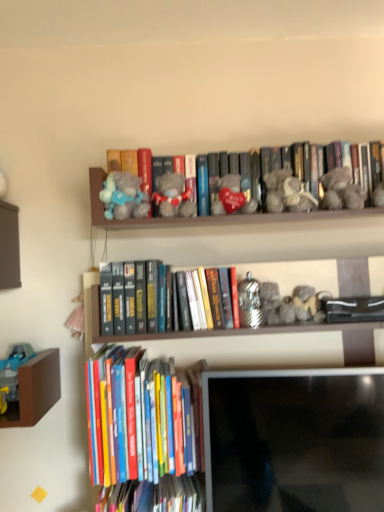
The height and width of the screenshot is (512, 384). Find the location of `hardcover book at lower center, acting as the 3th book starting from the top`. hardcover book at lower center, acting as the 3th book starting from the top is located at coordinates (153, 496).

What do you see at coordinates (142, 417) in the screenshot? The height and width of the screenshot is (512, 384). I see `hardcover books at lower left, the second book viewed from the top` at bounding box center [142, 417].

Based on the photo, in order to face fuzzy gray teddy bear at upper right, which is the first toy in right-to-left order, should I rotate leftwards or rightwards?

Rotate your view right by about 19.348°.

This screenshot has width=384, height=512. What are the coordinates of `fluffy gray teddy bear at upper center, the fourth toy viewed from the right` in the screenshot? It's located at (123, 196).

In order to click on velvet heart at center, marked as the 3th toy in a left-to-right arrangement in this screenshot , I will do `click(232, 197)`.

Locate an element on the screen. fluffy plush bear at center, arranged as the third toy when viewed from the right is located at coordinates (173, 196).

Is matte black monitor at lower center positioned far away from fuzzy gray teddy bear at upper right, which is the first toy in right-to-left order?

That's not correct — matte black monitor at lower center is a little close to fuzzy gray teddy bear at upper right, which is the first toy in right-to-left order.

Is matte black monitor at lower center to the left or to the right of fuzzy gray teddy bear at upper right, which is the first toy in right-to-left order, in the image?

In the image, matte black monitor at lower center appears on the left side of fuzzy gray teddy bear at upper right, which is the first toy in right-to-left order.

Considering the sizes of matte black monitor at lower center and fuzzy gray teddy bear at upper right, the fourth toy when ordered from left to right, in the image, is matte black monitor at lower center bigger or smaller than fuzzy gray teddy bear at upper right, the fourth toy when ordered from left to right,?

matte black monitor at lower center is bigger than fuzzy gray teddy bear at upper right, the fourth toy when ordered from left to right.

From a real-world perspective, is matte black monitor at lower center positioned above or below fuzzy gray teddy bear at upper right, which is the first toy in right-to-left order?

Clearly, from a real-world perspective, matte black monitor at lower center is below fuzzy gray teddy bear at upper right, which is the first toy in right-to-left order.

Is gray plush bear at center, the third book ordered from the bottom, inside or outside of fuzzy gray teddy bear at upper right, the fourth toy when ordered from left to right?

gray plush bear at center, the third book ordered from the bottom, cannot be found inside fuzzy gray teddy bear at upper right, the fourth toy when ordered from left to right.

Where is `book behind the fuzzy gray teddy bear at upper right, which is the first toy in right-to-left order`? The height and width of the screenshot is (512, 384). book behind the fuzzy gray teddy bear at upper right, which is the first toy in right-to-left order is located at coordinates (321, 206).

Looking at this image, considering the relative sizes of gray plush bear at center, which is the 1th book in top-to-bottom order, and fuzzy gray teddy bear at upper right, which is the first toy in right-to-left order, in the image provided, is gray plush bear at center, which is the 1th book in top-to-bottom order, shorter than fuzzy gray teddy bear at upper right, which is the first toy in right-to-left order,?

In fact, gray plush bear at center, which is the 1th book in top-to-bottom order, may be taller than fuzzy gray teddy bear at upper right, which is the first toy in right-to-left order.

Can you confirm if gray plush bear at center, the third book ordered from the bottom, is smaller than fuzzy gray teddy bear at upper right, which is the first toy in right-to-left order?

No.

From the image's perspective, is fuzzy gray teddy bear at upper right, the fourth toy when ordered from left to right, located above fluffy plush bear at center, arranged as the third toy when viewed from the right?

Correct, fuzzy gray teddy bear at upper right, the fourth toy when ordered from left to right, appears higher than fluffy plush bear at center, arranged as the third toy when viewed from the right, in the image.

Is fuzzy gray teddy bear at upper right, the fourth toy when ordered from left to right, facing away from fluffy plush bear at center, the second toy viewed from the left?

No, fuzzy gray teddy bear at upper right, the fourth toy when ordered from left to right, is not facing away from fluffy plush bear at center, the second toy viewed from the left.

What's the angular difference between fuzzy gray teddy bear at upper right, the fourth toy when ordered from left to right, and fluffy plush bear at center, the second toy viewed from the left,'s facing directions?

There is a 0.00179-degree angle between the facing directions of fuzzy gray teddy bear at upper right, the fourth toy when ordered from left to right, and fluffy plush bear at center, the second toy viewed from the left.

Is fuzzy gray teddy bear at upper right, the fourth toy when ordered from left to right, wider than fluffy plush bear at center, arranged as the third toy when viewed from the right?

Yes, fuzzy gray teddy bear at upper right, the fourth toy when ordered from left to right, is wider than fluffy plush bear at center, arranged as the third toy when viewed from the right.

Which is correct: gray plush bear at center, which is the 1th book in top-to-bottom order, is inside hardcover books at lower left, the second book viewed from the top, or outside of it?

gray plush bear at center, which is the 1th book in top-to-bottom order, lies outside hardcover books at lower left, the second book viewed from the top.

Is gray plush bear at center, which is the 1th book in top-to-bottom order, not close to hardcover books at lower left, the second book viewed from the top?

Actually, gray plush bear at center, which is the 1th book in top-to-bottom order, and hardcover books at lower left, the second book viewed from the top, are a little close together.

Considering the sizes of objects gray plush bear at center, which is the 1th book in top-to-bottom order, and hardcover books at lower left, the second book viewed from the top, in the image provided, who is thinner, gray plush bear at center, which is the 1th book in top-to-bottom order, or hardcover books at lower left, the second book viewed from the top,?

With smaller width is gray plush bear at center, which is the 1th book in top-to-bottom order.

From the image's perspective, is matte black monitor at lower center located above or below hardcover books at lower left, positioned as the 2th book in bottom-to-top order?

Based on their image positions, matte black monitor at lower center is located above hardcover books at lower left, positioned as the 2th book in bottom-to-top order.

Does point (308, 408) come farther from viewer compared to point (181, 398)?

No.

Is matte black monitor at lower center oriented towards hardcover books at lower left, the second book viewed from the top?

No, matte black monitor at lower center is not facing towards hardcover books at lower left, the second book viewed from the top.

From a real-world perspective, relative to hardcover books at lower left, positioned as the 2th book in bottom-to-top order, is matte black monitor at lower center vertically above or below?

From a real-world perspective, matte black monitor at lower center is physically below hardcover books at lower left, positioned as the 2th book in bottom-to-top order.

Which object is positioned more to the left, fluffy gray teddy bear at upper center, the fourth toy viewed from the right, or hardcover books at lower left, positioned as the 2th book in bottom-to-top order?

fluffy gray teddy bear at upper center, the fourth toy viewed from the right, is more to the left.

Considering the sizes of objects fluffy gray teddy bear at upper center, the fourth toy viewed from the right, and hardcover books at lower left, the second book viewed from the top, in the image provided, who is smaller, fluffy gray teddy bear at upper center, the fourth toy viewed from the right, or hardcover books at lower left, the second book viewed from the top,?

With smaller size is fluffy gray teddy bear at upper center, the fourth toy viewed from the right.

How many degrees apart are the facing directions of fluffy gray teddy bear at upper center, the first toy positioned from the left, and hardcover books at lower left, positioned as the 2th book in bottom-to-top order?

fluffy gray teddy bear at upper center, the first toy positioned from the left, and hardcover books at lower left, positioned as the 2th book in bottom-to-top order, are facing 0.537 degrees away from each other.

Consider the image. Relative to hardcover book at lower center, acting as the 3th book starting from the top, is fuzzy gray teddy bear at upper right, the fourth toy when ordered from left to right, in front or behind?

In the image, fuzzy gray teddy bear at upper right, the fourth toy when ordered from left to right, appears behind hardcover book at lower center, acting as the 3th book starting from the top.

Is fuzzy gray teddy bear at upper right, the fourth toy when ordered from left to right, positioned far away from hardcover book at lower center, acting as the 3th book starting from the top?

Actually, fuzzy gray teddy bear at upper right, the fourth toy when ordered from left to right, and hardcover book at lower center, acting as the 3th book starting from the top, are a little close together.

From a real-world perspective, which is physically below, fuzzy gray teddy bear at upper right, which is the first toy in right-to-left order, or hardcover book at lower center, acting as the 3th book starting from the top?

From a 3D spatial view, hardcover book at lower center, acting as the 3th book starting from the top, is below.

Is fuzzy gray teddy bear at upper right, which is the first toy in right-to-left order, completely or partially outside of hardcover book at lower center, acting as the 3th book starting from the top?

Yes, fuzzy gray teddy bear at upper right, which is the first toy in right-to-left order, is located beyond the bounds of hardcover book at lower center, acting as the 3th book starting from the top.

From a real-world perspective, count 1st toys upward from the matte black monitor at lower center and point to it. Please provide its 2D coordinates.

[(341, 190)]

Find the location of a particular element. Image resolution: width=384 pixels, height=512 pixels. book behind the fuzzy gray teddy bear at upper right, which is the first toy in right-to-left order is located at coordinates (321, 206).

When comparing their distances from fluffy gray teddy bear at upper center, the first toy positioned from the left, does gray plush bear at center, the third book ordered from the bottom, or matte black monitor at lower center seem further?

Based on the image, matte black monitor at lower center appears to be further to fluffy gray teddy bear at upper center, the first toy positioned from the left.

Considering their positions, is velvet heart at center, marked as the 3th toy in a left-to-right arrangement, positioned further to hardcover books at lower left, positioned as the 2th book in bottom-to-top order, than gray plush bear at center, the third book ordered from the bottom?

velvet heart at center, marked as the 3th toy in a left-to-right arrangement, is positioned further to the anchor hardcover books at lower left, positioned as the 2th book in bottom-to-top order.

Considering their positions, is gray plush bear at center, the third book ordered from the bottom, positioned further to matte black monitor at lower center than fuzzy gray teddy bear at upper right, the fourth toy when ordered from left to right?

fuzzy gray teddy bear at upper right, the fourth toy when ordered from left to right, is positioned further to the anchor matte black monitor at lower center.

From the image, which object appears to be farther from fluffy plush bear at center, arranged as the third toy when viewed from the right, hardcover books at lower left, positioned as the 2th book in bottom-to-top order, or fuzzy gray teddy bear at upper right, the fourth toy when ordered from left to right?

The object further to fluffy plush bear at center, arranged as the third toy when viewed from the right, is hardcover books at lower left, positioned as the 2th book in bottom-to-top order.

Which object lies further to the anchor point hardcover books at lower left, positioned as the 2th book in bottom-to-top order, matte black monitor at lower center or gray plush bear at center, which is the 1th book in top-to-bottom order?

gray plush bear at center, which is the 1th book in top-to-bottom order, lies further to hardcover books at lower left, positioned as the 2th book in bottom-to-top order, than the other object.

Which object lies nearer to the anchor point fuzzy gray teddy bear at upper right, which is the first toy in right-to-left order, velvet heart at center, acting as the 2th toy starting from the right, or matte black monitor at lower center?

The object closer to fuzzy gray teddy bear at upper right, which is the first toy in right-to-left order, is velvet heart at center, acting as the 2th toy starting from the right.

Which object lies further to the anchor point velvet heart at center, acting as the 2th toy starting from the right, hardcover books at lower left, positioned as the 2th book in bottom-to-top order, or matte black monitor at lower center?

matte black monitor at lower center is further to velvet heart at center, acting as the 2th toy starting from the right.

Estimate the real-world distances between objects in this image. Which object is closer to velvet heart at center, marked as the 3th toy in a left-to-right arrangement, fluffy gray teddy bear at upper center, the first toy positioned from the left, or hardcover books at lower left, the second book viewed from the top?

fluffy gray teddy bear at upper center, the first toy positioned from the left.

Locate an element on the screen. This screenshot has width=384, height=512. book between fuzzy gray teddy bear at upper right, which is the first toy in right-to-left order, and hardcover book at lower center, which is the 1th book in bottom-to-top order, from top to bottom is located at coordinates (142, 417).

The image size is (384, 512). I want to click on computer monitor between fluffy gray teddy bear at upper center, the first toy positioned from the left, and hardcover books at lower left, the second book viewed from the top, vertically, so click(x=294, y=440).

This screenshot has width=384, height=512. Find the location of `computer monitor between velvet heart at center, acting as the 2th toy starting from the right, and hardcover book at lower center, acting as the 3th book starting from the top, in the vertical direction`. computer monitor between velvet heart at center, acting as the 2th toy starting from the right, and hardcover book at lower center, acting as the 3th book starting from the top, in the vertical direction is located at coordinates (294, 440).

Image resolution: width=384 pixels, height=512 pixels. I want to click on book between gray plush bear at center, which is the 1th book in top-to-bottom order, and hardcover book at lower center, acting as the 3th book starting from the top, vertically, so click(142, 417).